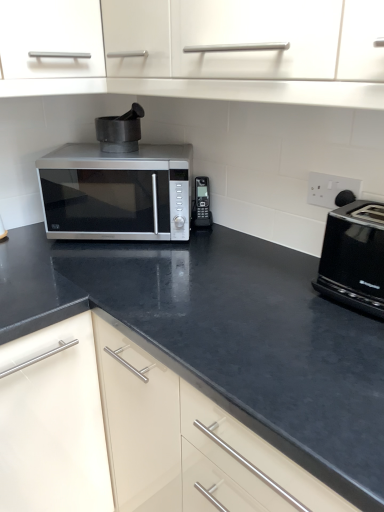
Question: From a real-world perspective, is black plastic toaster at right above or below black matte mortar at center, which is the second appliance in right-to-left order?

Choices:
 (A) below
 (B) above

Answer: (A)

Question: Is black plastic toaster at right wider or thinner than black matte mortar at center, the 1th appliance from the top?

Choices:
 (A) wide
 (B) thin

Answer: (A)

Question: Which is nearer to the white plastic electric outlet at upper right?

Choices:
 (A) satin silver microwave at center
 (B) black plastic phone at center, the 2th appliance from the top
 (C) black matte mortar at center, which is the 1th appliance from left to right
 (D) black plastic toaster at right

Answer: (D)

Question: Estimate the real-world distances between objects in this image. Which object is farther from the black matte mortar at center, which is the 1th appliance from left to right?

Choices:
 (A) satin silver microwave at center
 (B) white plastic electric outlet at upper right
 (C) black plastic toaster at right
 (D) black plastic phone at center, acting as the 1th appliance starting from the right

Answer: (C)